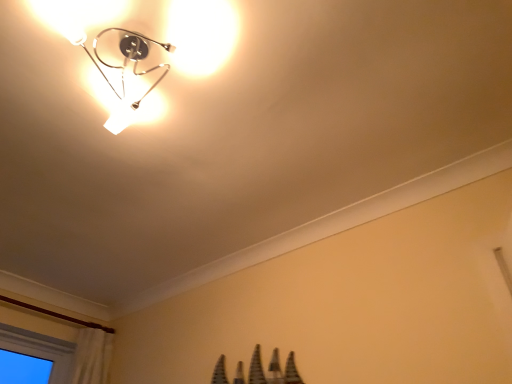
Image resolution: width=512 pixels, height=384 pixels. Describe the element at coordinates (98, 53) in the screenshot. I see `metallic chrome fixture at upper left` at that location.

This screenshot has width=512, height=384. Identify the location of metallic chrome fixture at upper left. (98, 53).

The width and height of the screenshot is (512, 384). I want to click on metallic chrome fixture at upper left, so click(98, 53).